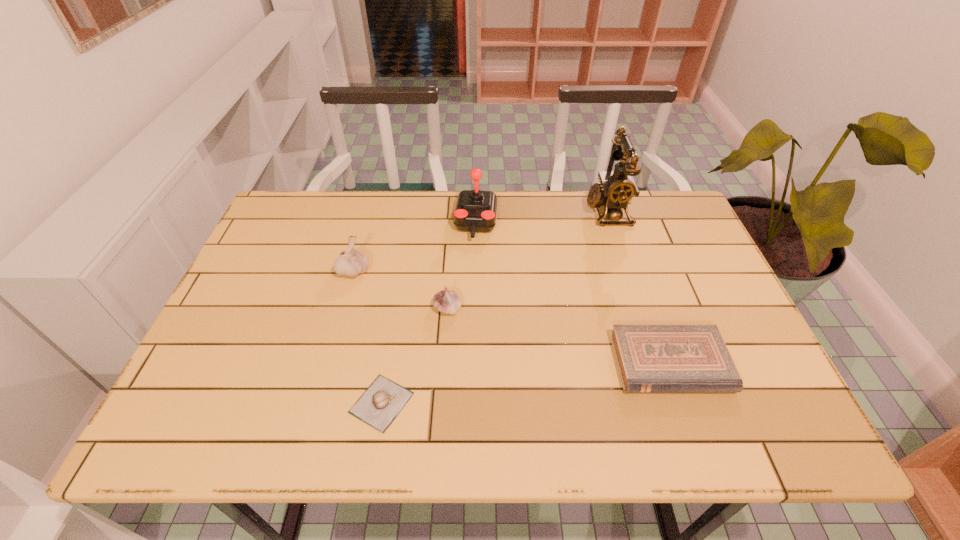
This screenshot has height=540, width=960. In order to click on vacant position in the image that satisfies the following two spatial constraints: 1. on the back side of the second garlic from right to left; 2. on the right side of the joystick in this screenshot , I will do `click(412, 223)`.

In order to click on free region that satisfies the following two spatial constraints: 1. on the rotary dial of the telephone; 2. on the front side of the second garlic from left to right in this screenshot , I will do `click(670, 403)`.

The width and height of the screenshot is (960, 540). Identify the location of vacant point that satisfies the following two spatial constraints: 1. on the rotary dial of the tallest object; 2. on the front side of the joystick. (612, 223).